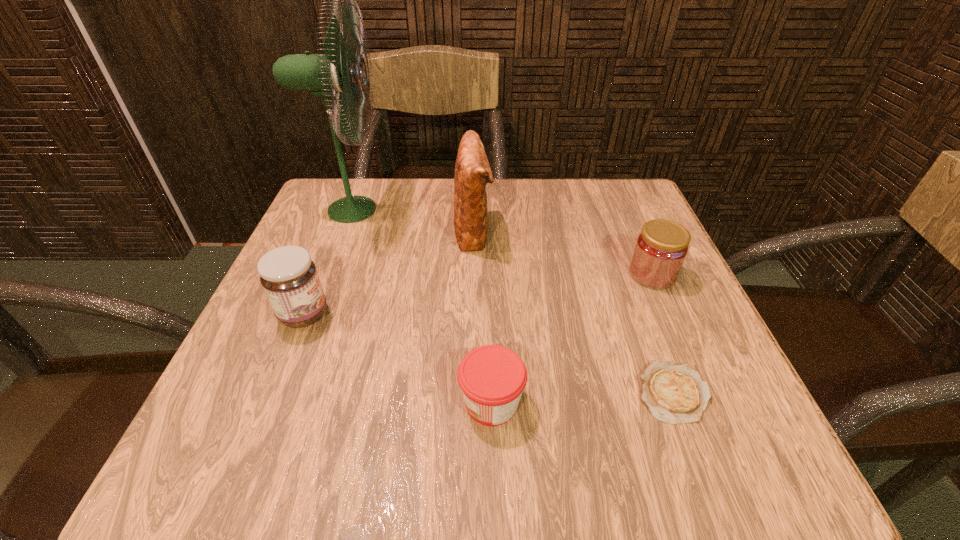
Find the location of a particular element. free location that satisfies the following two spatial constraints: 1. on the front-facing side of the quiche; 2. on the right side of the tallest object is located at coordinates (279, 392).

The image size is (960, 540). I want to click on vacant position in the image that satisfies the following two spatial constraints: 1. on the front label of the quiche; 2. on the right side of the third nearest object, so click(272, 392).

Locate an element on the screen. This screenshot has height=540, width=960. free space that satisfies the following two spatial constraints: 1. on the front side of the shortest object; 2. on the label side of the nearest jam is located at coordinates (677, 402).

Where is `blank space that satisfies the following two spatial constraints: 1. on the front label of the tallest jam; 2. on the back side of the shortest object`? This screenshot has width=960, height=540. blank space that satisfies the following two spatial constraints: 1. on the front label of the tallest jam; 2. on the back side of the shortest object is located at coordinates (272, 392).